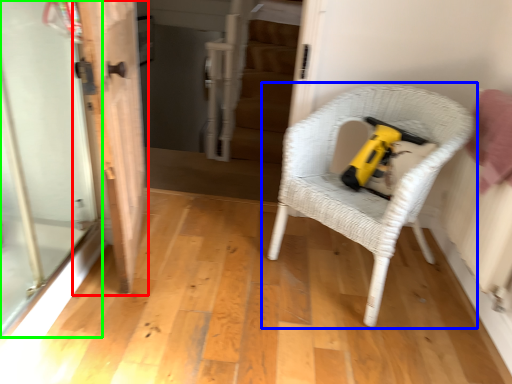
Question: Based on their relative distances, which object is nearer to door (highlighted by a red box)? Choose from chair (highlighted by a blue box) and screen door (highlighted by a green box).

Choices:
 (A) chair
 (B) screen door

Answer: (B)